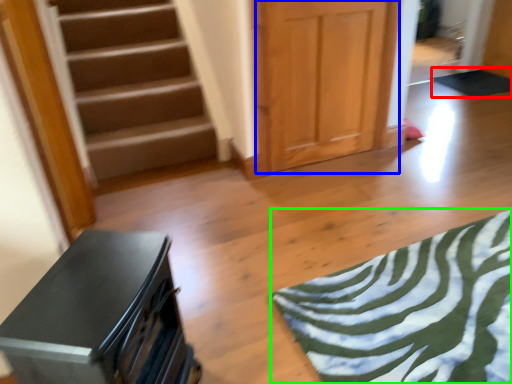
Question: Which is farther away from yoga mat (highlighted by a red box)? door (highlighted by a blue box) or yoga mat (highlighted by a green box)?

Choices:
 (A) door
 (B) yoga mat

Answer: (B)